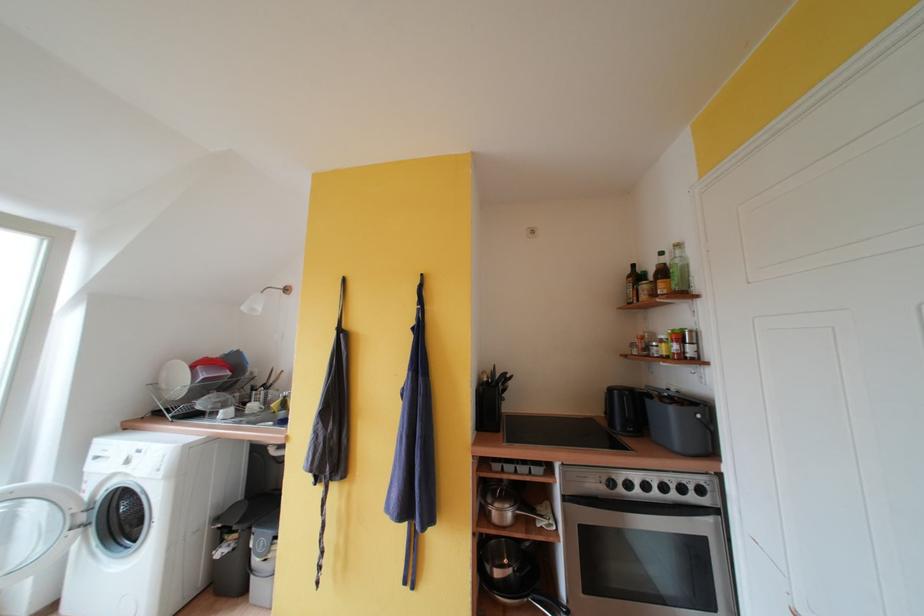
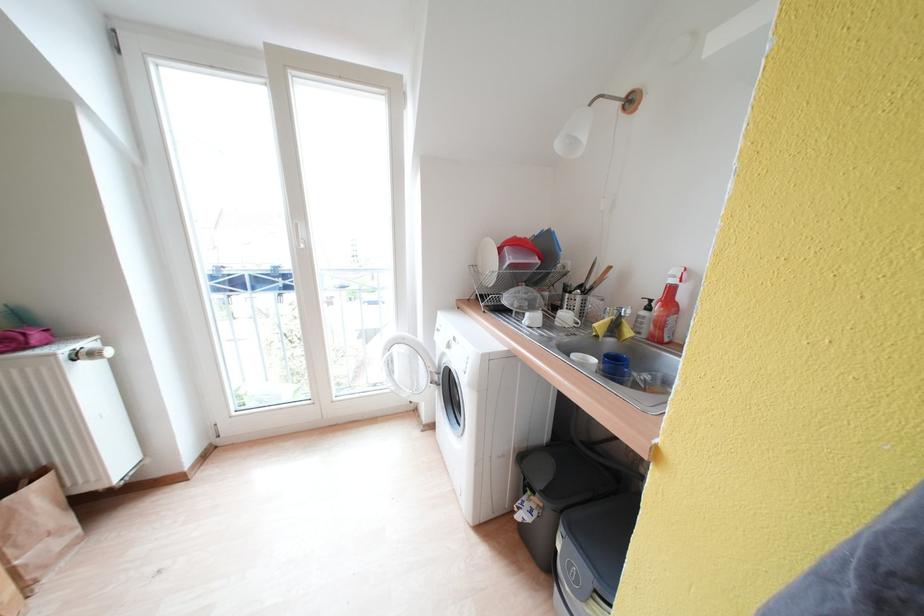
The point at (259, 410) is marked in the first image. Where is the corresponding point in the second image?

(572, 320)